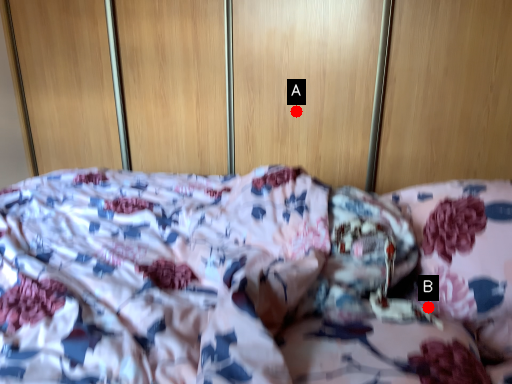
Question: Two points are circled on the image, labeled by A and B beside each circle. Which point is farther from the camera taking this photo?

Choices:
 (A) A is further
 (B) B is further

Answer: (A)